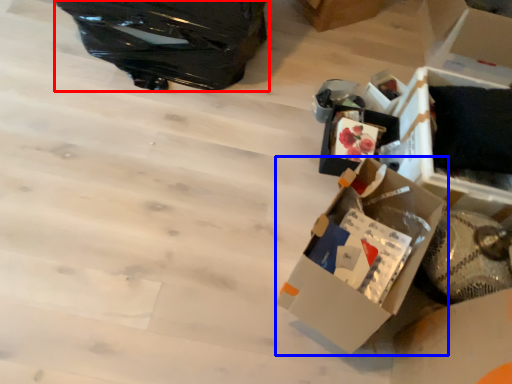
Question: Which point is further to the camera, suitcase (highlighted by a red box) or box (highlighted by a blue box)?

Choices:
 (A) suitcase
 (B) box

Answer: (A)